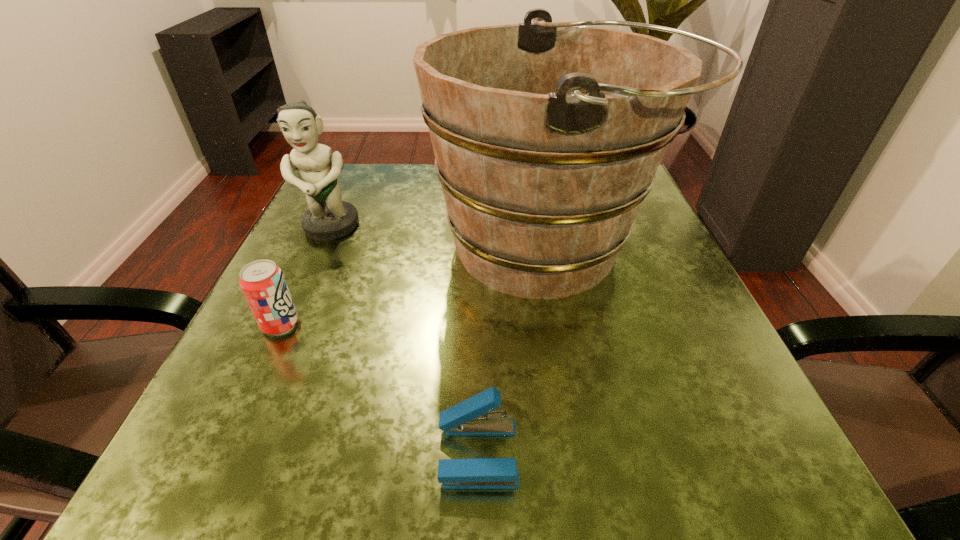
Find the location of a particular element. The image size is (960, 540). unoccupied position between the soda can and the shortest object is located at coordinates (379, 389).

Where is `empty space that is in between the figurine and the bucket`? This screenshot has height=540, width=960. empty space that is in between the figurine and the bucket is located at coordinates (440, 238).

Locate which object is the third closest to the bucket. Please provide its 2D coordinates. Your answer should be formatted as a tuple, i.e. [(x, y)], where the tuple contains the x and y coordinates of a point satisfying the conditions above.

[(264, 286)]

Select which object appears as the second closest to the second tallest object. Please provide its 2D coordinates. Your answer should be formatted as a tuple, i.e. [(x, y)], where the tuple contains the x and y coordinates of a point satisfying the conditions above.

[(264, 286)]

The height and width of the screenshot is (540, 960). Find the location of `vacant region that satisfies the following two spatial constraints: 1. on the handle side of the bucket; 2. on the front side of the shortest object`. vacant region that satisfies the following two spatial constraints: 1. on the handle side of the bucket; 2. on the front side of the shortest object is located at coordinates (588, 453).

This screenshot has height=540, width=960. I want to click on free location that satisfies the following two spatial constraints: 1. on the front-facing side of the third shortest object; 2. on the left side of the nearest object, so click(x=230, y=453).

This screenshot has width=960, height=540. Find the location of `vacant area in the image that satisfies the following two spatial constraints: 1. on the front-facing side of the shortest object; 2. on the right side of the figurine`. vacant area in the image that satisfies the following two spatial constraints: 1. on the front-facing side of the shortest object; 2. on the right side of the figurine is located at coordinates coord(230,453).

Locate an element on the screen. The height and width of the screenshot is (540, 960). free space that satisfies the following two spatial constraints: 1. on the front-facing side of the third shortest object; 2. on the right side of the nearest object is located at coordinates (230, 453).